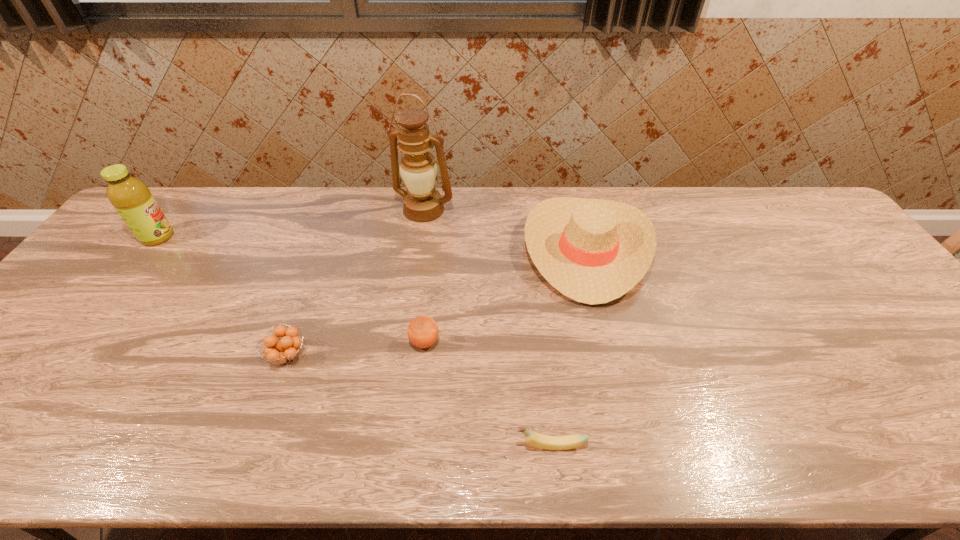
You are a GUI agent. You are given a task and a screenshot of the screen. Output one action in this format:
    pyautogui.click(x=<x>, y=<y>)
    Task: Click on the object present at the far left corner
    The width and height of the screenshot is (960, 540).
    Given the screenshot: What is the action you would take?
    pyautogui.click(x=132, y=199)

In the image, there is a desktop. Where is `free region at the far edge`? free region at the far edge is located at coordinates (602, 196).

Where is `vacant space at the near edge of the desktop`? This screenshot has width=960, height=540. vacant space at the near edge of the desktop is located at coordinates (402, 434).

Locate an element on the screen. This screenshot has width=960, height=540. free space that is in between the banana and the leftmost object is located at coordinates (354, 341).

Locate an element on the screen. free space between the second object from left to right and the fruit juice is located at coordinates (223, 296).

Find the location of a particular element. This screenshot has height=540, width=960. free area in between the leftmost object and the banana is located at coordinates (354, 341).

Locate an element on the screen. The height and width of the screenshot is (540, 960). free space between the left orange fruit and the leftmost object is located at coordinates (223, 296).

At what (x,y) coordinates should I click in order to perform the action: click on vacant space in between the banana and the oil lamp. Please return your answer as a coordinate pair (x, y). Looking at the image, I should click on (487, 327).

Locate an element on the screen. empty location between the right orange fruit and the sunhat is located at coordinates (505, 296).

Where is `free space between the oil lamp and the right orange fruit`? free space between the oil lamp and the right orange fruit is located at coordinates (424, 276).